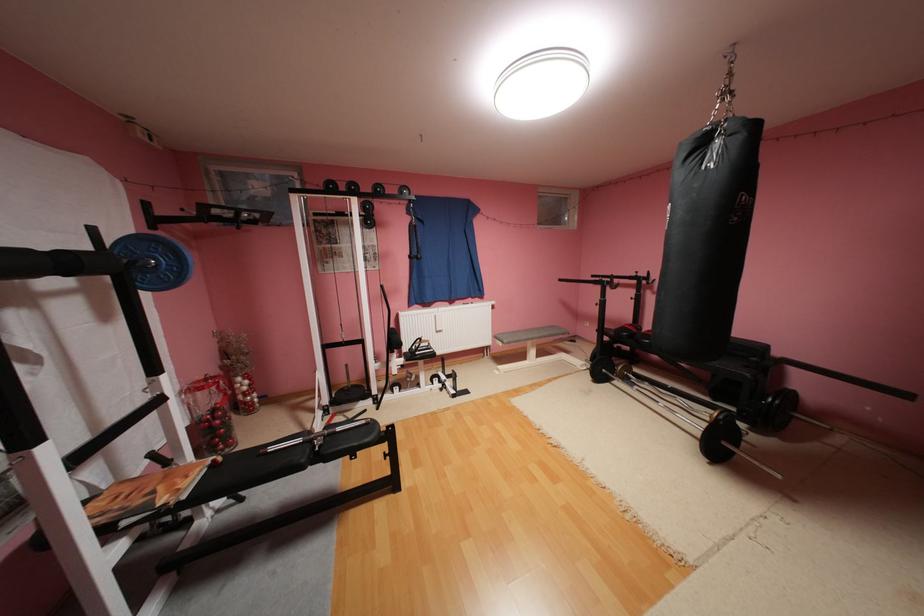
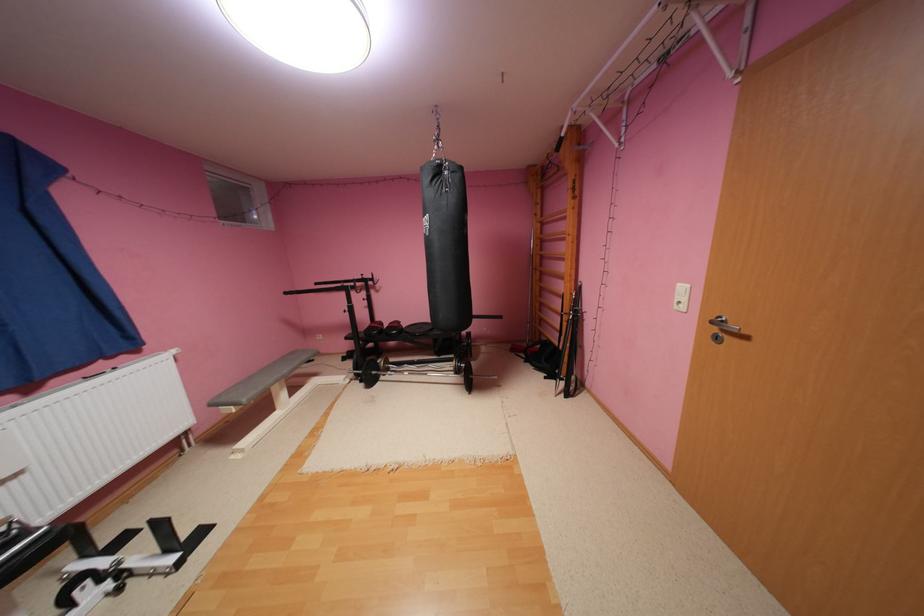
The point at (723, 376) is marked in the first image. Where is the corresponding point in the second image?

(444, 339)